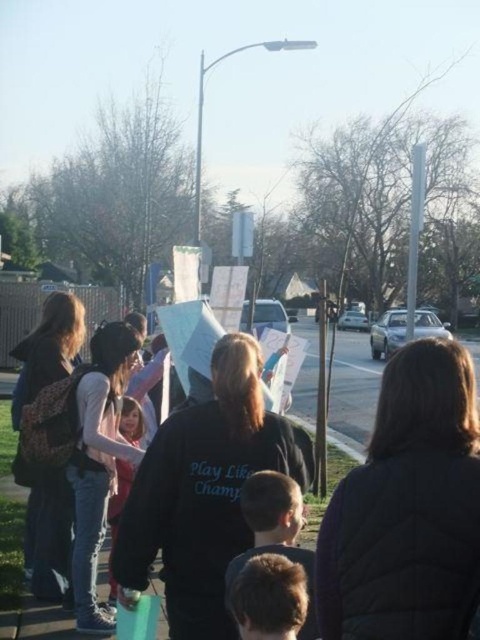
Question: Which point is farther from the camera taking this photo?

Choices:
 (A) (124, 474)
 (B) (372, 378)

Answer: (B)

Question: Which object is farther from the camera taking this photo?

Choices:
 (A) black fabric crowd at center
 (B) light pink fabric at center

Answer: (B)

Question: Is black fabric crowd at center smaller than light pink fabric at center?

Choices:
 (A) yes
 (B) no

Answer: (B)

Question: Can you confirm if black fabric crowd at center is positioned above light pink fabric at center?

Choices:
 (A) no
 (B) yes

Answer: (B)

Question: Does black fabric crowd at center have a greater width compared to light pink fabric at center?

Choices:
 (A) no
 (B) yes

Answer: (B)

Question: Which point is closer to the camera taking this photo?

Choices:
 (A) (140, 435)
 (B) (373, 369)

Answer: (A)